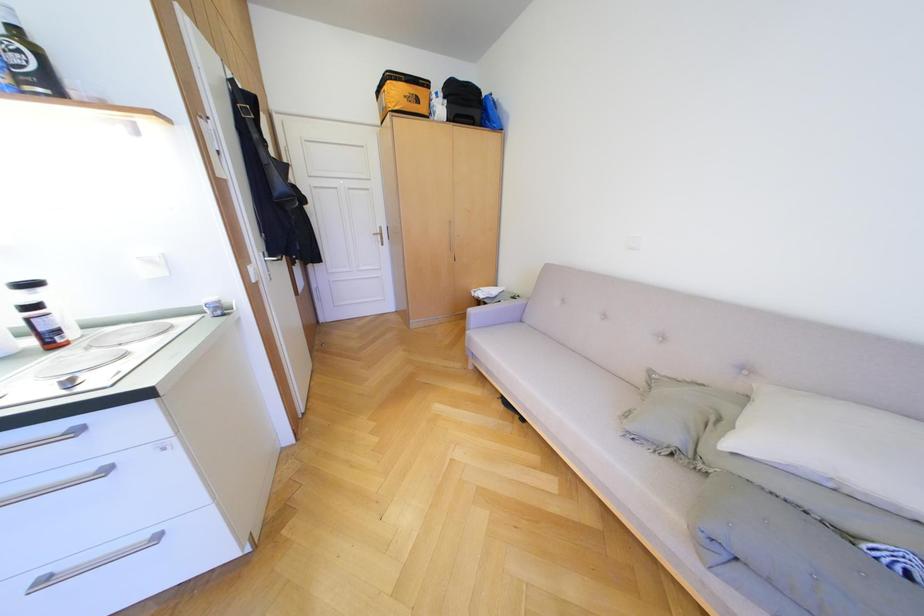
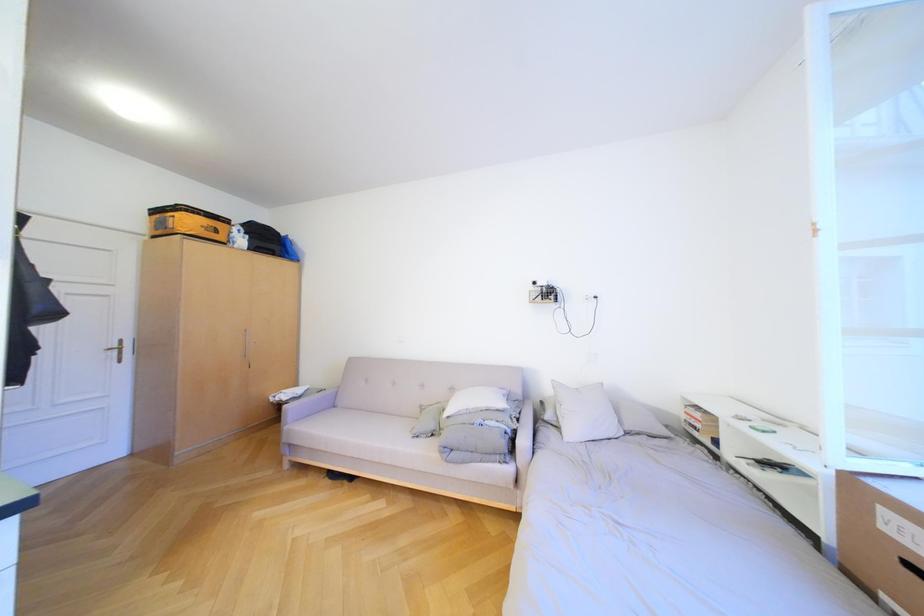
In the scene shown: How did the camera likely rotate?

The camera's rotation is toward right-up.